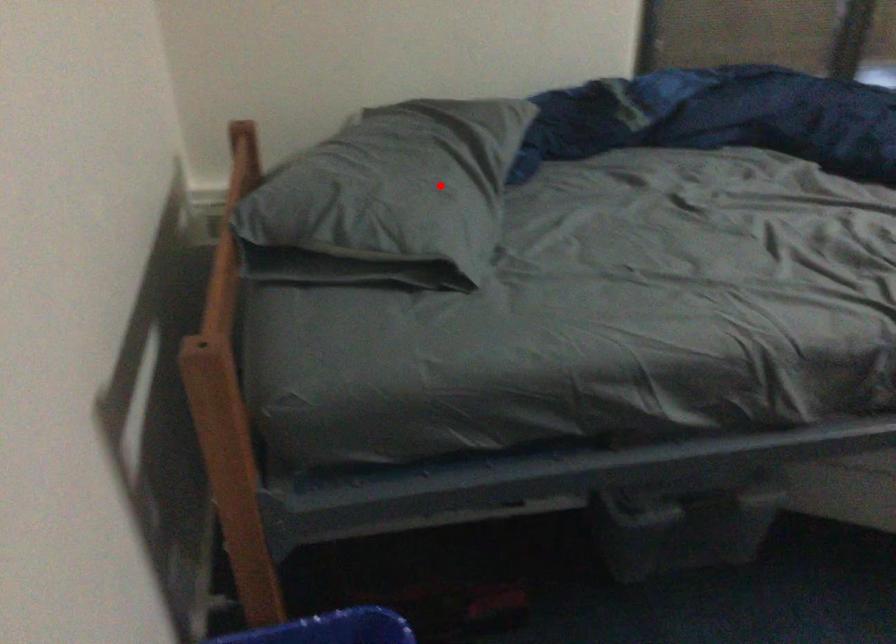
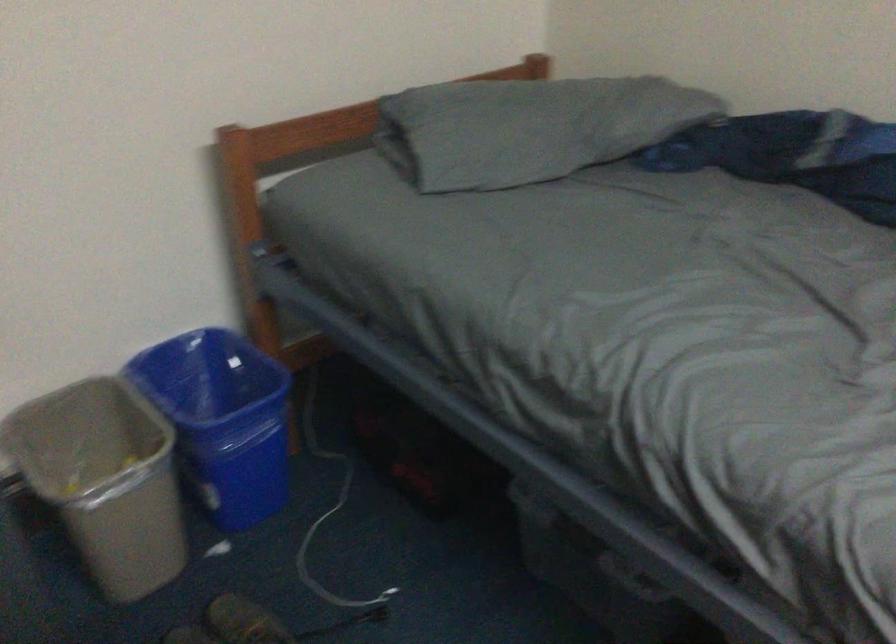
Question: I am providing you with two images of the same scene from different viewpoints. Given a red point in image1, look at the same physical point in image2. Is it:

Choices:
 (A) Closer to the viewpoint
 (B) Farther from the viewpoint

Answer: (B)